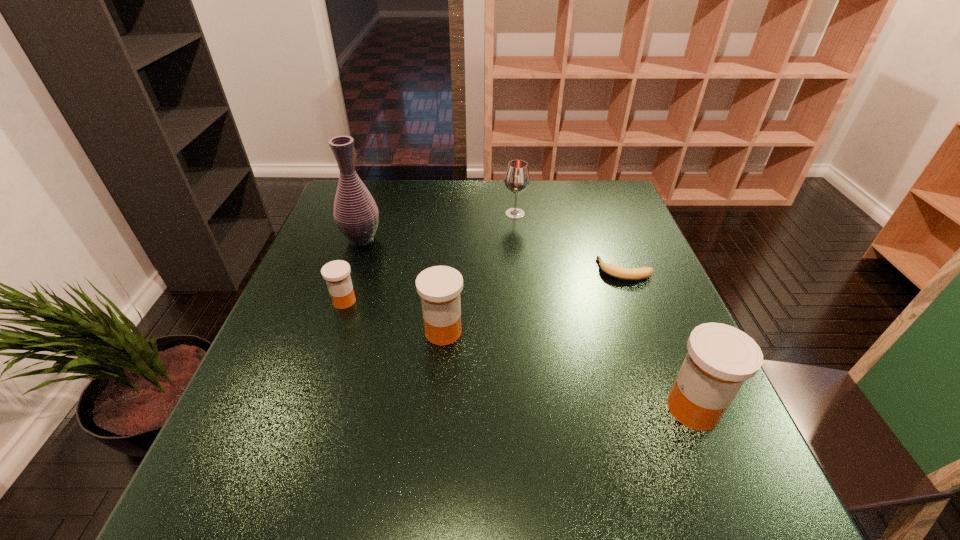
Where is `banana`? banana is located at coordinates (615, 271).

This screenshot has height=540, width=960. Identify the location of the shortest object. (615, 271).

I want to click on free space located on the label of the shortest medicine, so click(x=399, y=301).

Identify the location of vacant space located on the label of the second shortest medicine. This screenshot has width=960, height=540. (541, 332).

The height and width of the screenshot is (540, 960). I want to click on vacant space situated 0.340m on the left of the fourth object from left to right, so click(x=391, y=214).

Locate an element on the screen. vacant area located on the back of the vase is located at coordinates (376, 197).

The image size is (960, 540). What are the coordinates of `vacant space located on the front of the banana` in the screenshot? It's located at (641, 313).

Where is `object that is at the far edge`? The width and height of the screenshot is (960, 540). object that is at the far edge is located at coordinates (517, 179).

What are the coordinates of `object that is at the near edge` in the screenshot? It's located at (720, 358).

Identify the location of medicine situated at the left edge. This screenshot has width=960, height=540. (336, 273).